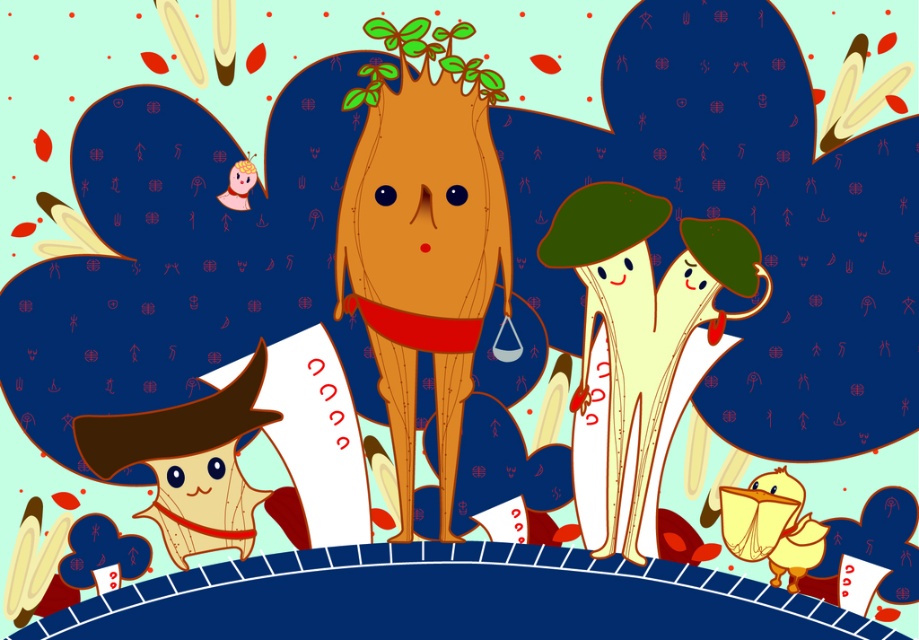
Question: Does smooth brown tree trunk at center come in front of smooth cream mushrooms at center?

Choices:
 (A) yes
 (B) no

Answer: (B)

Question: Can you confirm if smooth brown tree trunk at center is positioned to the left of smooth cream mushrooms at center?

Choices:
 (A) yes
 (B) no

Answer: (A)

Question: Is smooth brown tree trunk at center wider than smooth cream mushrooms at center?

Choices:
 (A) yes
 (B) no

Answer: (B)